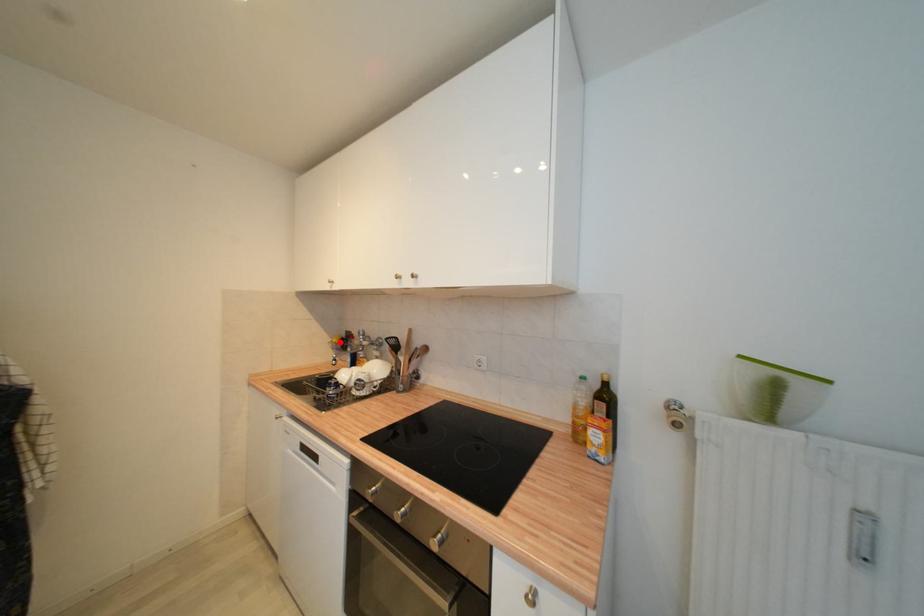
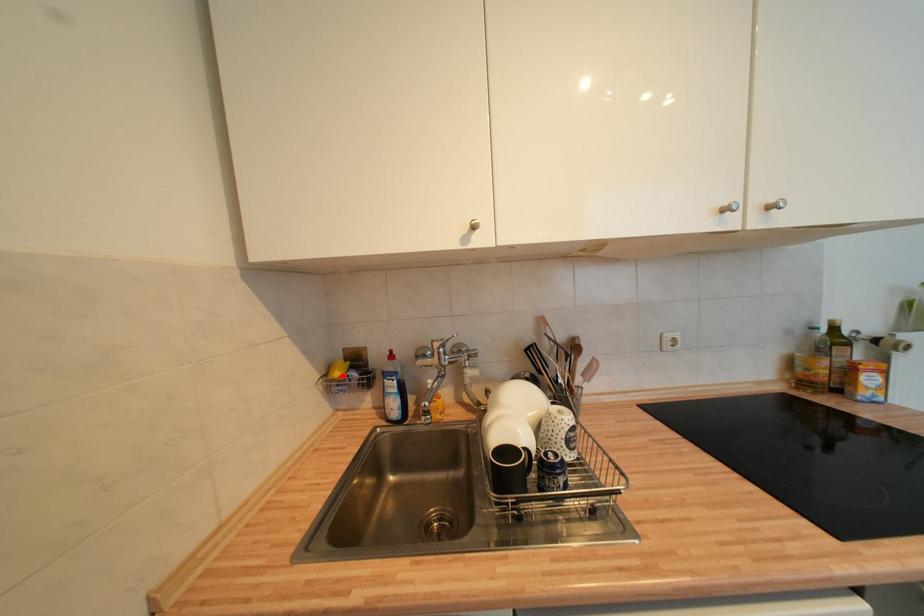
I am providing you with two images of the same scene from different viewpoints. A red point is marked on the first image and another point is marked on the second image. Is the red point in image1 aligned with the point shown in image2?

Yes